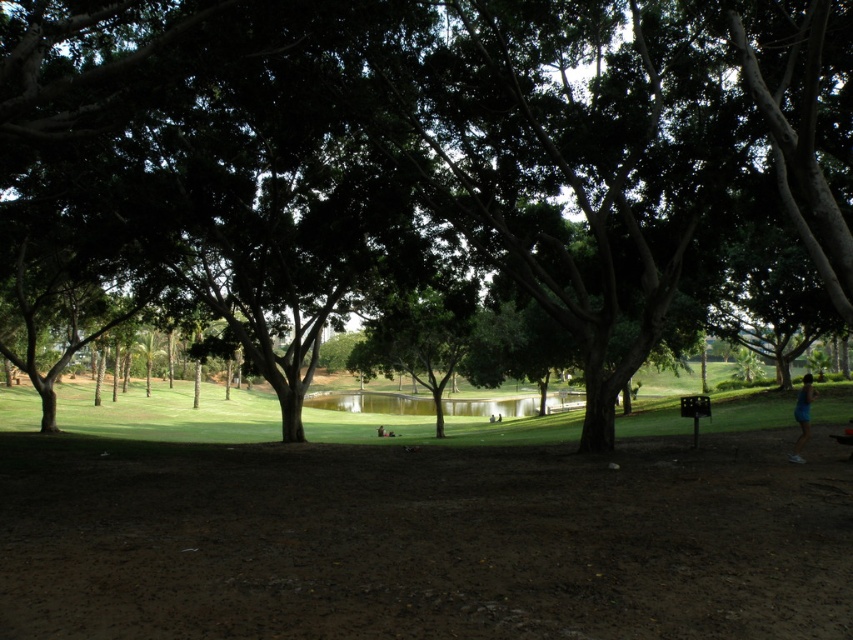
Can you confirm if green leafy tree at center is thinner than green smooth water at center?

Indeed, green leafy tree at center has a lesser width compared to green smooth water at center.

Which of these two, green leafy tree at center or green smooth water at center, stands taller?

Standing taller between the two is green leafy tree at center.

Between point (581, 122) and point (306, 404), which one is positioned behind?

The point (306, 404) is more distant.

At what (x,y) coordinates should I click in order to perform the action: click on green leafy tree at center. Please return your answer as a coordinate pair (x, y). The image size is (853, 640). Looking at the image, I should click on (405, 150).

From the picture: Which of these two, green smooth water at center or blue fabric shorts at lower right, stands shorter?

With less height is blue fabric shorts at lower right.

Locate an element on the screen. This screenshot has height=640, width=853. green smooth water at center is located at coordinates (373, 403).

How much distance is there between green leafy tree at center and blue fabric shorts at lower right?

12.56 meters

Is green leafy tree at center shorter than blue fabric shorts at lower right?

No.

Is point (427, 120) positioned in front of point (798, 445)?

No, it is behind (798, 445).

Identify the location of green leafy tree at center. (405, 150).